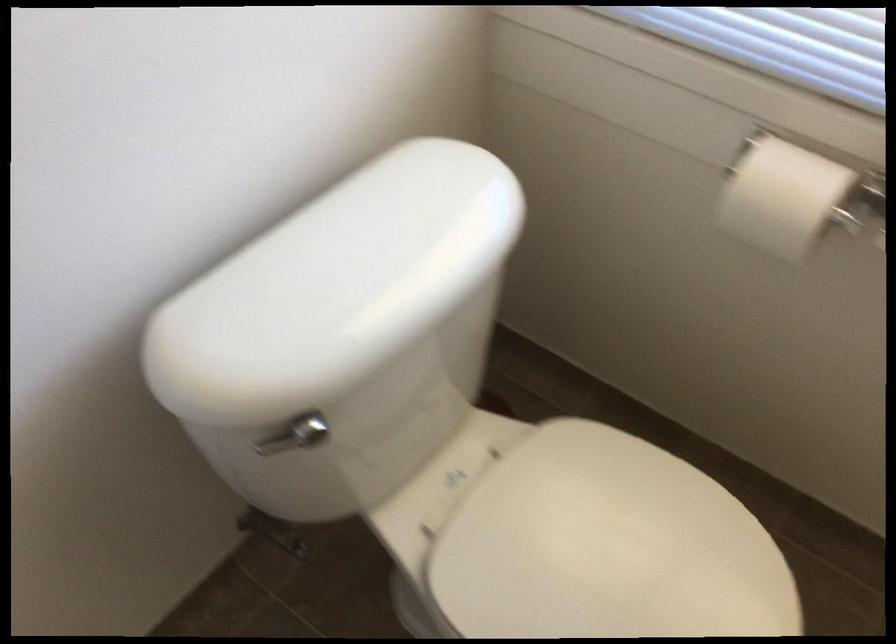
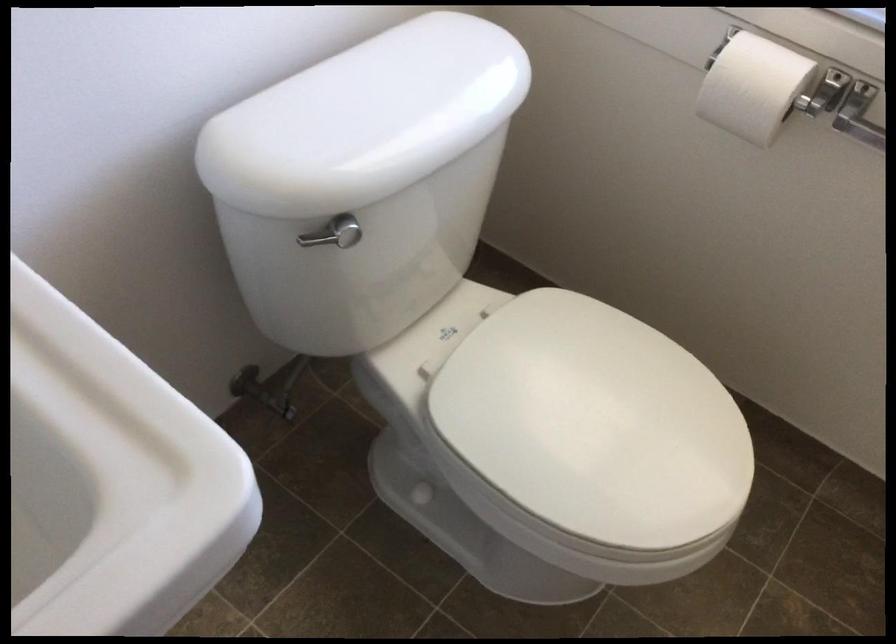
The point at (777, 205) is marked in the first image. Where is the corresponding point in the second image?

(753, 87)